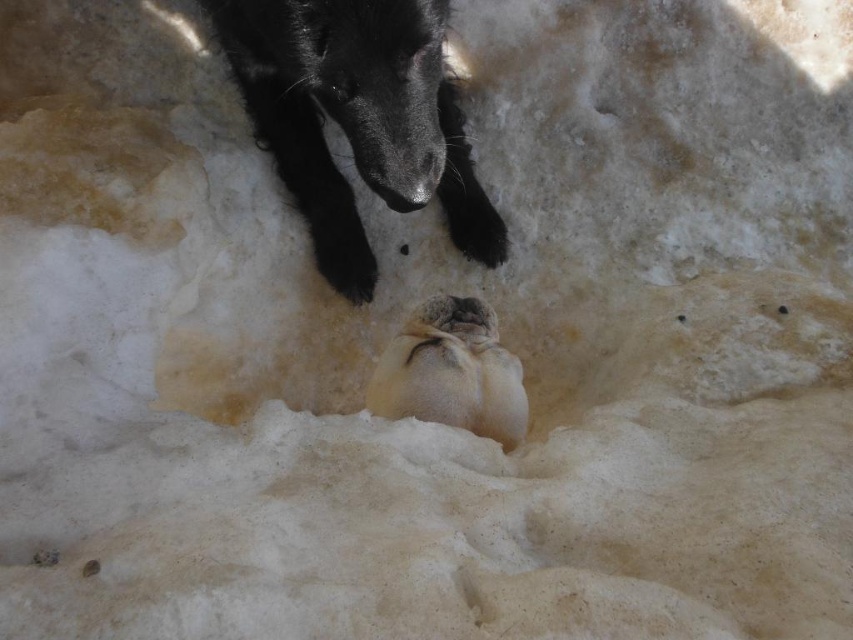
Question: Among these objects, which one is farthest from the camera?

Choices:
 (A) fuzzy white seal at center
 (B) black fur animal at upper center

Answer: (A)

Question: In this image, where is black fur animal at upper center located relative to fuzzy white seal at center?

Choices:
 (A) left
 (B) right

Answer: (A)

Question: Is black fur animal at upper center to the left of fuzzy white seal at center from the viewer's perspective?

Choices:
 (A) no
 (B) yes

Answer: (B)

Question: Among these points, which one is nearest to the camera?

Choices:
 (A) (311, 202)
 (B) (444, 401)

Answer: (B)

Question: Is the position of black fur animal at upper center more distant than that of fuzzy white seal at center?

Choices:
 (A) yes
 (B) no

Answer: (B)